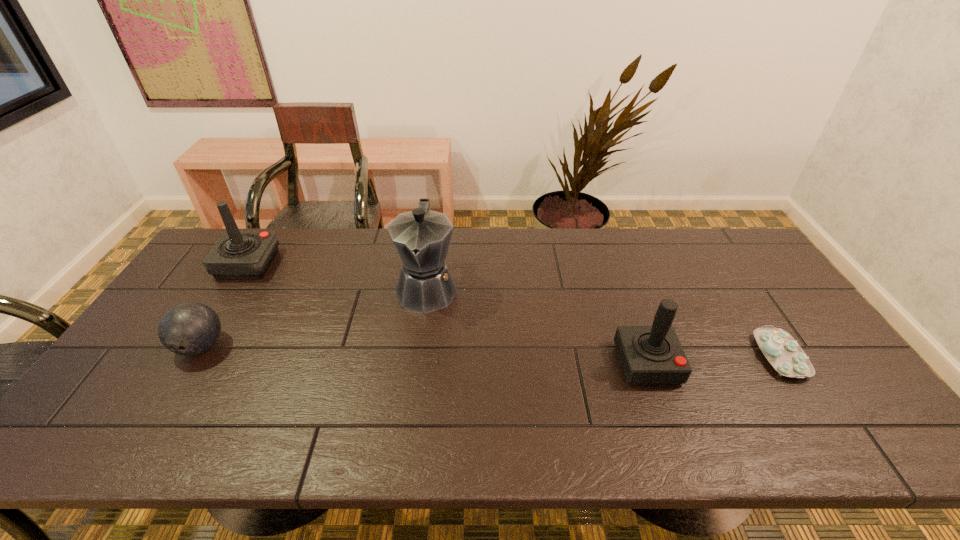
The height and width of the screenshot is (540, 960). Find the location of `vacant region located 0.060m on the base of the nearer joystick`. vacant region located 0.060m on the base of the nearer joystick is located at coordinates (663, 408).

Identify the location of blank area located 0.070m on the grip area of the fourth tallest object. (175, 390).

Where is `vacant area located 0.350m on the back of the chinaware`? vacant area located 0.350m on the back of the chinaware is located at coordinates (714, 254).

Find the location of a particular element. coffeepot present at the far edge is located at coordinates (422, 237).

Locate an element on the screen. joystick present at the far edge is located at coordinates (238, 254).

Locate an element on the screen. joystick that is positioned at the left edge is located at coordinates (238, 254).

Locate an element on the screen. bowling ball located in the left edge section of the desktop is located at coordinates (187, 329).

What are the coordinates of `object present at the right edge` in the screenshot? It's located at (786, 356).

This screenshot has height=540, width=960. I want to click on object at the far left corner, so click(x=238, y=254).

Identify the location of vacant space at the far edge of the desktop. (329, 247).